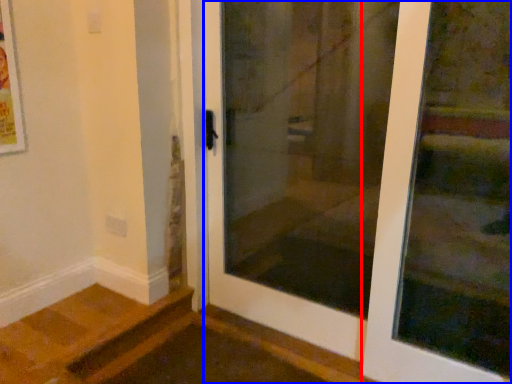
Question: Which of the following is the closest to the observer, door (highlighted by a red box) or door (highlighted by a blue box)?

Choices:
 (A) door
 (B) door

Answer: (B)